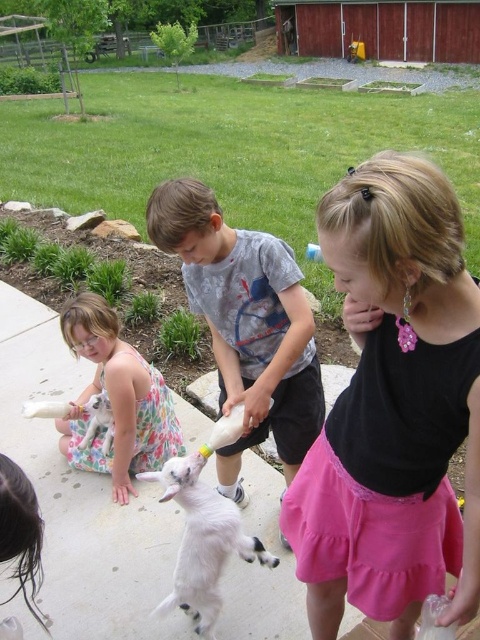
Question: Based on their relative distances, which object is nearer to the matte gray shirt at center?

Choices:
 (A) pink satin skirt at lower right
 (B) floral dress at lower left
 (C) white fluffy lamb at center

Answer: (C)

Question: Which of the following is the closest to the observer?

Choices:
 (A) white fluffy lamb at center
 (B) pink satin skirt at lower right

Answer: (B)

Question: From the image, what is the correct spatial relationship of pink satin skirt at lower right in relation to white fluffy lamb at center?

Choices:
 (A) right
 (B) left

Answer: (A)

Question: Which point is farther to the camera?

Choices:
 (A) pink satin skirt at lower right
 (B) matte gray shirt at center
 (C) white fluffy lamb at center

Answer: (B)

Question: Does floral dress at lower left appear on the right side of white fluffy lamb at center?

Choices:
 (A) no
 (B) yes

Answer: (A)

Question: Does pink satin skirt at lower right appear over white fluffy lamb at center?

Choices:
 (A) no
 (B) yes

Answer: (B)